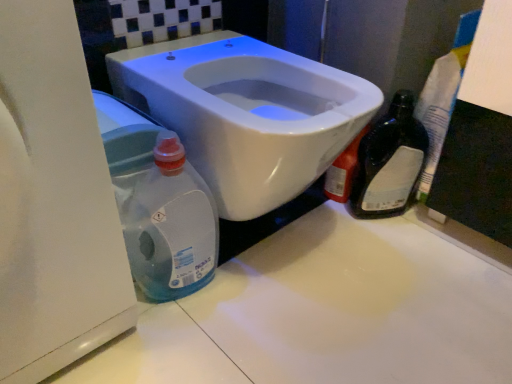
The height and width of the screenshot is (384, 512). I want to click on vacant area in front of translucent plastic bottle at lower left, so click(x=174, y=348).